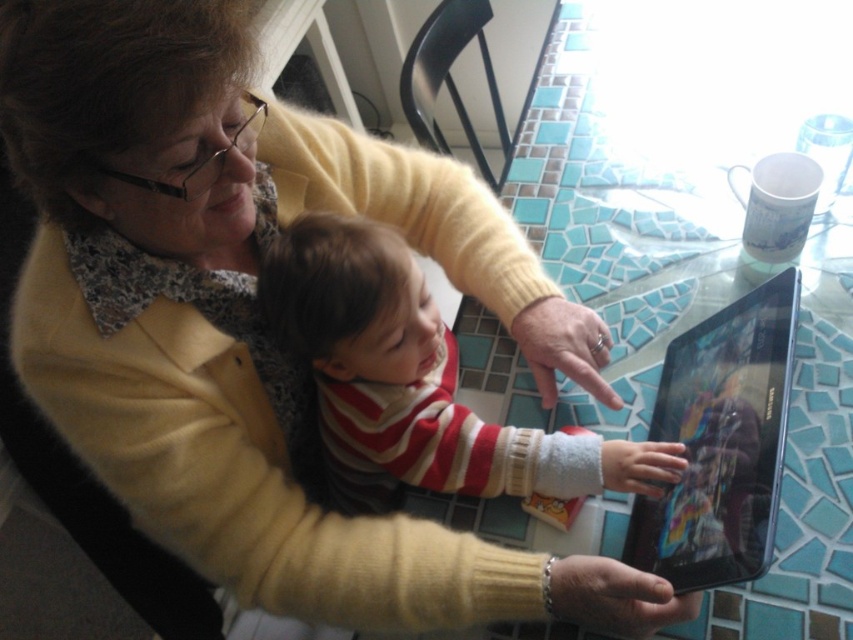
From the picture: You are a photographer trying to capture a closeup of the black glossy tablet at center while also including the striped sweater at center in the frame. Which object should you focus on first to ensure both are in focus?

You should focus on the striped sweater at center first because it is closer to the viewer than the black glossy tablet at center, so adjusting focus from near to far will help both be in focus.

You are designing a new tablecloth for this scene. The striped sweater at center and the black glossy tablet at center are both on the table. Which object requires a larger space on the table?

The striped sweater at center is wider than the black glossy tablet at center, so it requires a larger space on the table.

The scene shows a striped sweater at center and a black glossy tablet at center. Which object is positioned higher in the image?

The striped sweater at center is above the black glossy tablet at center in the image.